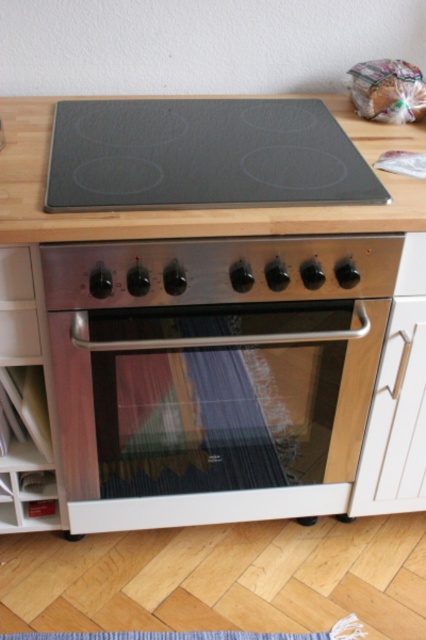
Between point (250, 120) and point (402, 500), which one is positioned in front?

Positioned in front is point (250, 120).

Is point (261, 129) less distant than point (380, 396)?

No, (261, 129) is further to viewer.

I want to click on black glass cooktop at center, so click(x=203, y=156).

Which is below, white wood drawer at lower right or white glossy drawer at lower left?

white wood drawer at lower right is below.

Describe the element at coordinates (396, 419) in the screenshot. The height and width of the screenshot is (640, 426). I see `white wood drawer at lower right` at that location.

Is point (412, 352) farther from viewer compared to point (13, 252)?

Yes, point (412, 352) is behind point (13, 252).

Where is `white wood drawer at lower right`? white wood drawer at lower right is located at coordinates (396, 419).

Which is more to the right, black glass cooktop at center or white glossy drawer at lower left?

From the viewer's perspective, black glass cooktop at center appears more on the right side.

Locate an element on the screen. The height and width of the screenshot is (640, 426). black glass cooktop at center is located at coordinates [203, 156].